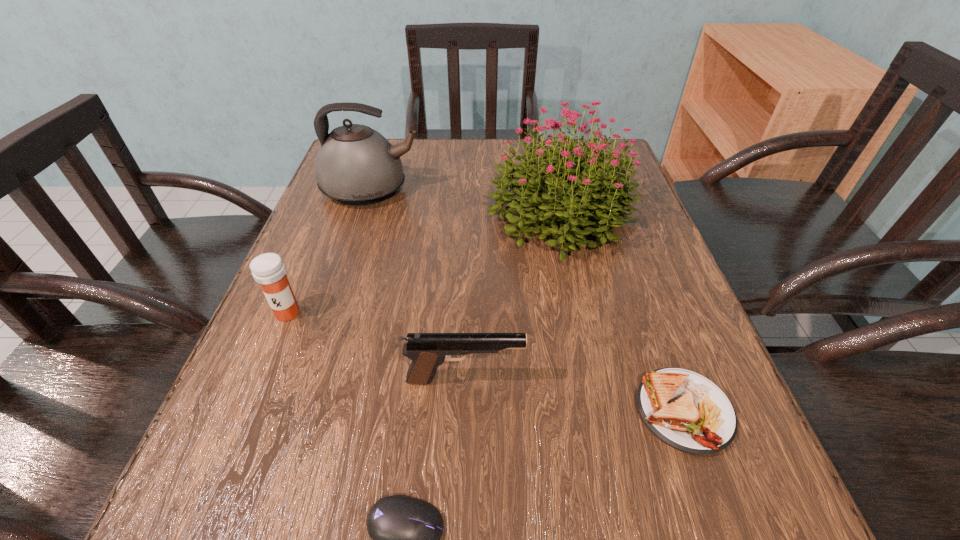
Locate an element on the screen. bouquet is located at coordinates (547, 181).

I want to click on the fifth shortest object, so point(356,165).

Where is `medicine`? Image resolution: width=960 pixels, height=540 pixels. medicine is located at coordinates (268, 269).

The width and height of the screenshot is (960, 540). Identify the location of pistol. (427, 351).

Identify the location of sandwich. (687, 411).

Find the location of `free spot located on the front of the bouquet`. free spot located on the front of the bouquet is located at coordinates (576, 287).

Image resolution: width=960 pixels, height=540 pixels. I want to click on free space located at the spout of the fifth shortest object, so click(x=527, y=191).

Where is `vacant space situated on the label side of the fourth nearest object`? This screenshot has width=960, height=540. vacant space situated on the label side of the fourth nearest object is located at coordinates (248, 409).

Where is `vacant space located at the muzzle of the pistol`? vacant space located at the muzzle of the pistol is located at coordinates (725, 379).

Identify the location of blank space located 0.270m on the back of the second shortest object. The height and width of the screenshot is (540, 960). (628, 256).